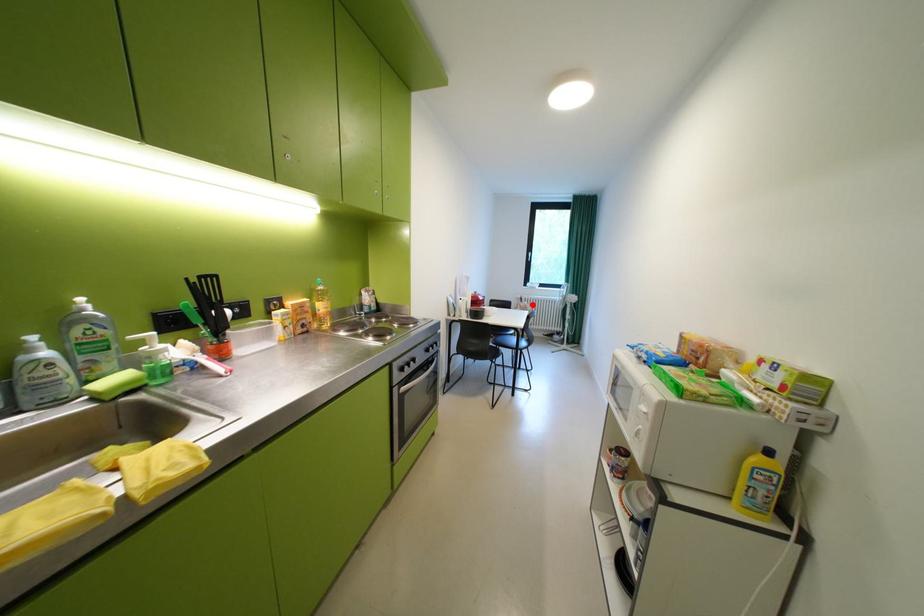
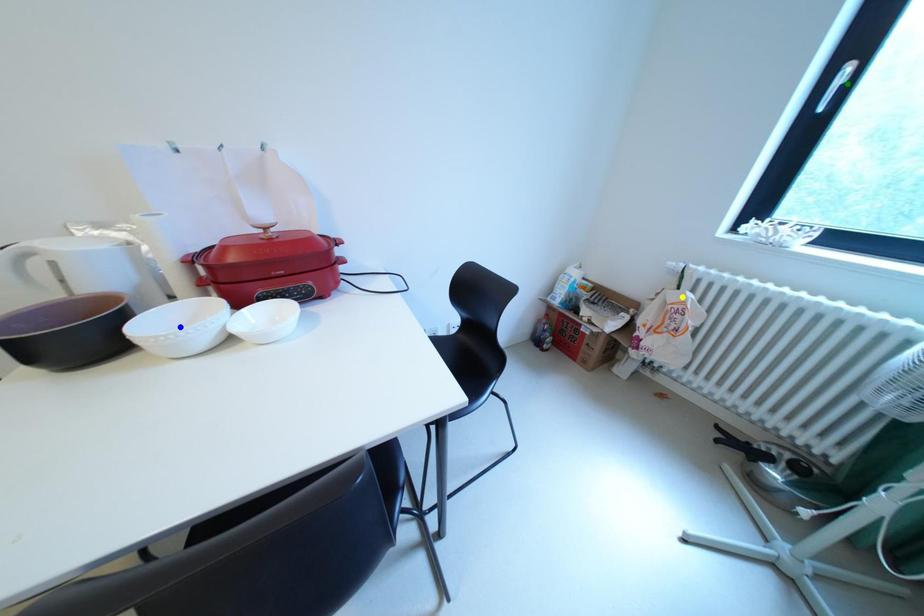
Question: I am providing you with two images of the same scene from different viewpoints. A red point is marked on the first image. You are given multiple points on the second image. Which point in image 2 represents the same 3d spot as the red point in image 1?

Choices:
 (A) yellow point
 (B) blue point
 (C) green point

Answer: (A)